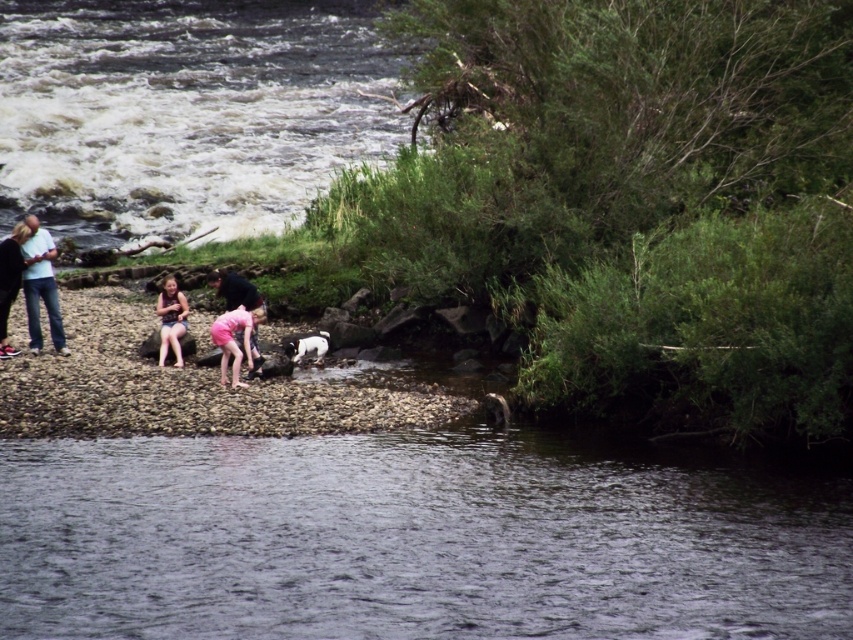
Consider the image. Is white frothy water at lower left thinner than matte blue jeans at left?

No.

Between point (352, 19) and point (49, 257), which one is positioned in front?

Point (49, 257) is more forward.

I want to click on white frothy water at lower left, so click(x=184, y=112).

Between point (734, 620) and point (294, 352), which one is positioned in front?

Point (734, 620)

What are the coordinates of `clear water at lower left` in the screenshot? It's located at (415, 538).

Does clear water at lower left have a greater height compared to white frothy water at lower left?

No.

Between clear water at lower left and white frothy water at lower left, which one has less height?

clear water at lower left is shorter.

Does point (62, 605) lie behind point (257, 13)?

No, it is in front of (257, 13).

Image resolution: width=853 pixels, height=640 pixels. In order to click on clear water at lower left in this screenshot , I will do `click(415, 538)`.